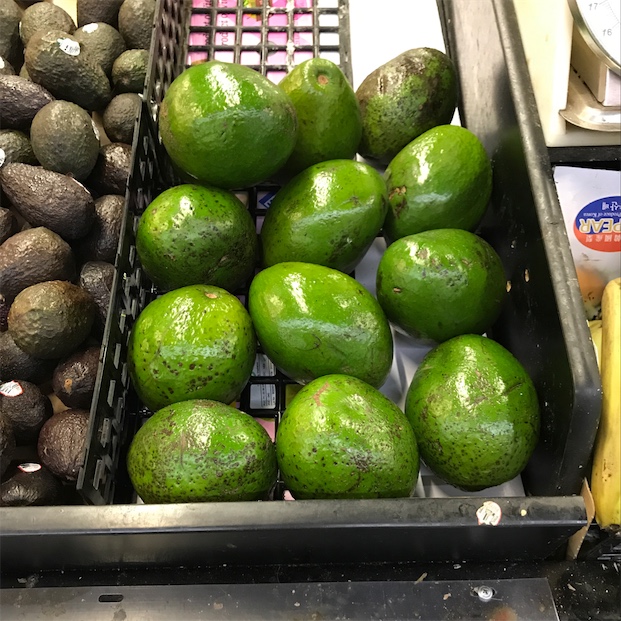
This screenshot has height=621, width=621. What are the coordinates of `sticker` in the screenshot? It's located at (487, 518), (9, 392), (30, 465).